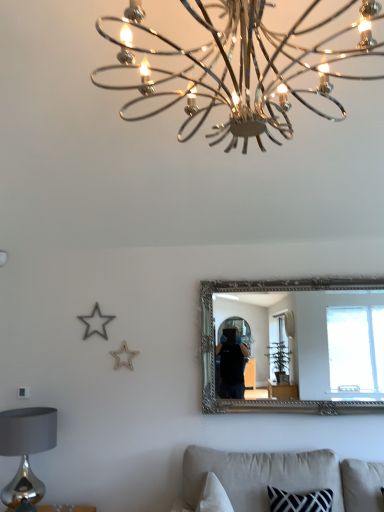
Question: From a real-world perspective, is chrome/metallic chandelier at upper center physically located above or below shiny silver table lamp at lower left?

Choices:
 (A) above
 (B) below

Answer: (A)

Question: In terms of width, does chrome/metallic chandelier at upper center look wider or thinner when compared to shiny silver table lamp at lower left?

Choices:
 (A) wide
 (B) thin

Answer: (A)

Question: Considering the real-world distances, which object is farthest from the chrome/metallic chandelier at upper center?

Choices:
 (A) shiny silver table lamp at lower left
 (B) silver ornate mirror at center
 (C) beige fabric couch at lower center

Answer: (B)

Question: Which is nearer to the shiny silver table lamp at lower left?

Choices:
 (A) chrome/metallic chandelier at upper center
 (B) beige fabric couch at lower center
 (C) silver ornate mirror at center

Answer: (B)